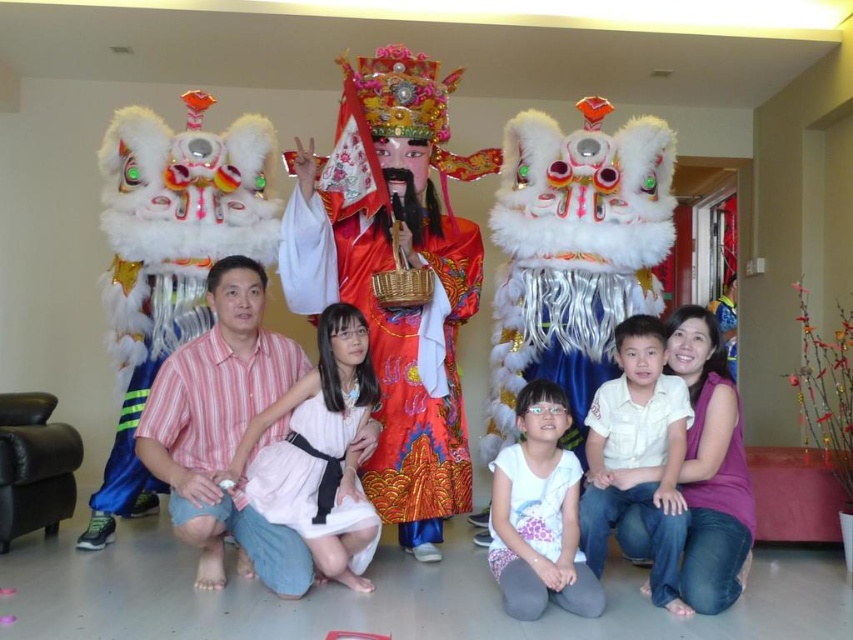
You are organizing a closet and need to decide which item takes up more horizontal space. Which has a greater width between the matte white dress at center and the white cotton shirt at lower right?

The matte white dress at center has a greater width than the white cotton shirt at lower right.

You are a photographer preparing to take a photo of the two dresses displayed in the center of the living room. The pink satin dress at center and the white matte dress at center are both in view. Which dress should you focus on first if you want to capture the larger one?

The pink satin dress at center is larger in size than the white matte dress at center, so you should focus on the pink satin dress at center first.